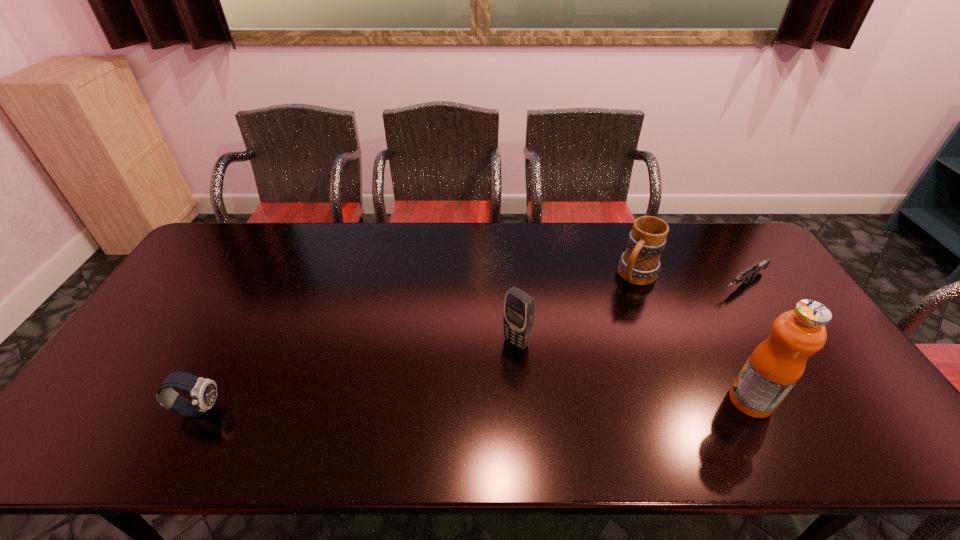
I want to click on vacant space on the desktop that is between the leftmost object and the fruit juice and is positioned on the side of the third object from right to left with the handle, so click(538, 404).

I want to click on free space on the desktop that is between the second shortest object and the second object from right to left and is positioned on the front face of the second object from left to right, so click(x=444, y=406).

At what (x,y) coordinates should I click in order to perform the action: click on vacant space on the desktop that is between the watch and the second object from right to left and is positioned aimed along the barrel of the gun. Please return your answer as a coordinate pair (x, y). Looking at the image, I should click on (556, 404).